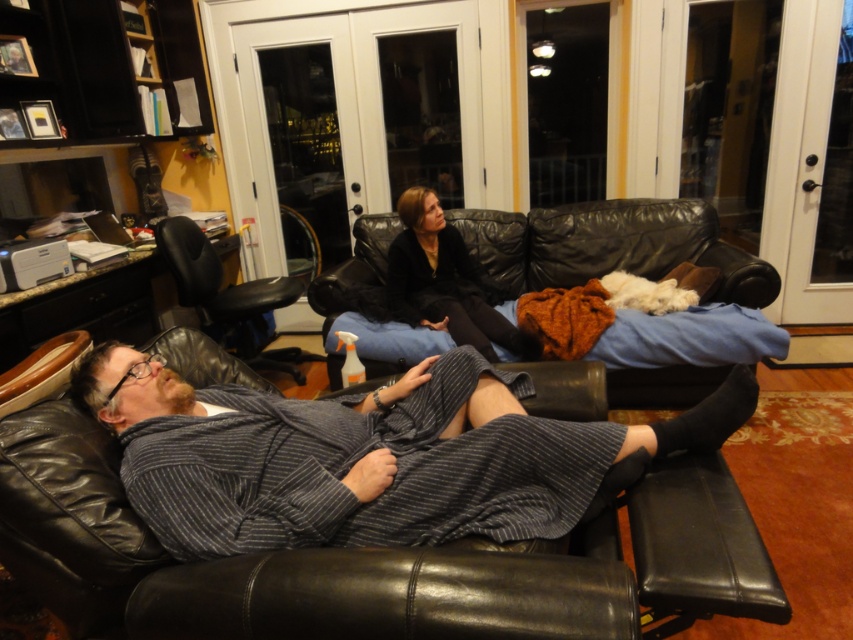
Question: Which of these objects is positioned closest to the black leather couch at center?

Choices:
 (A) striped wool robe at lower left
 (B) black leather chair at left

Answer: (B)

Question: Can you confirm if striped wool robe at lower left is positioned to the right of black leather couch at center?

Choices:
 (A) yes
 (B) no

Answer: (B)

Question: Does striped wool robe at lower left have a larger size compared to matte black leather couch at center?

Choices:
 (A) no
 (B) yes

Answer: (B)

Question: Which object is the closest to the black leather couch at center?

Choices:
 (A) striped wool robe at lower left
 (B) black leather chair at left
 (C) matte black leather couch at center

Answer: (C)

Question: Does striped wool robe at lower left appear under black leather couch at center?

Choices:
 (A) yes
 (B) no

Answer: (A)

Question: Which point appears closest to the camera in this image?

Choices:
 (A) (206, 241)
 (B) (297, 444)
 (C) (751, 284)

Answer: (B)